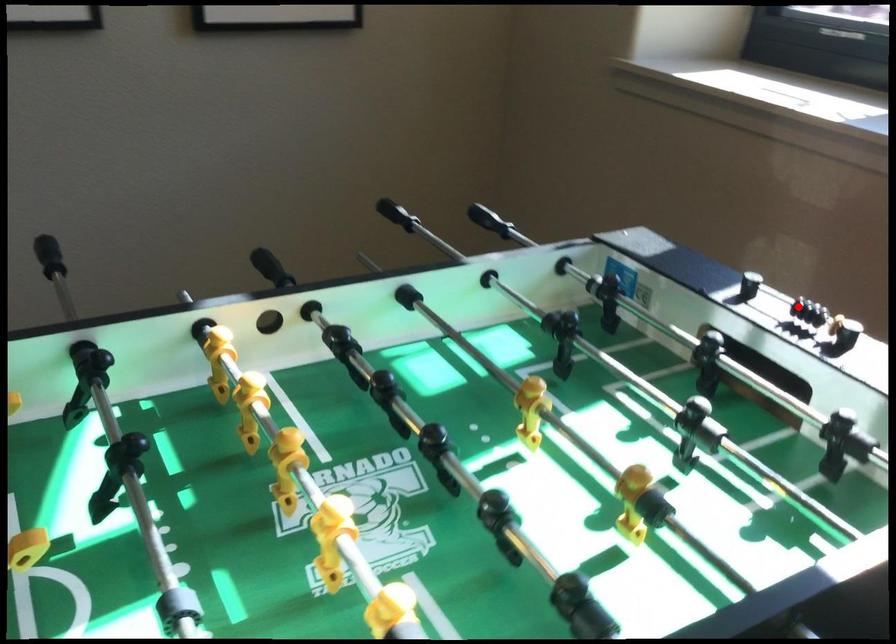
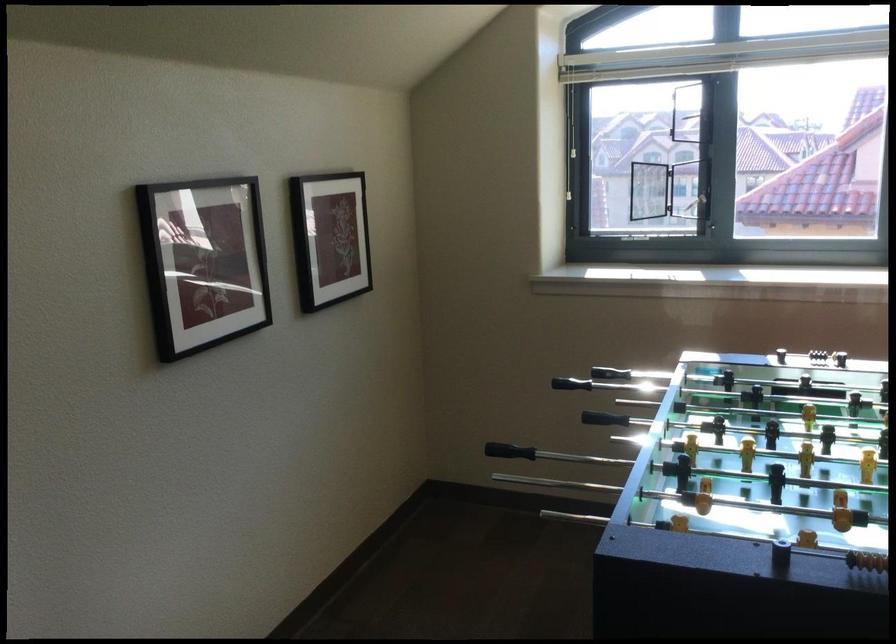
Question: I am providing you with two images of the same scene from different viewpoints. Image1 has a red point marked. In image2, the corresponding 3D location appears at what relative position? Reply with the corresponding letter.

Choices:
 (A) Closer
 (B) Farther

Answer: (B)